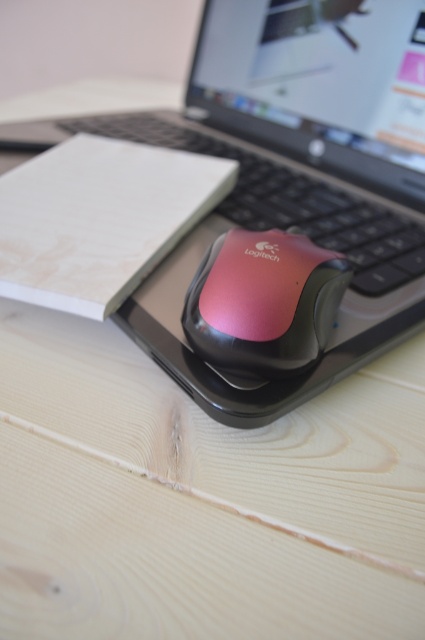
Consider the image. You are organizing your desk and need to place a small decorative item between the black plastic computer at center and the pink glossy mouse at center. Given their sizes, which object should you position closer to the edge of the desk to ensure the decorative item fits comfortably?

The pink glossy mouse at center is smaller in size than the black plastic computer at center, so positioning it closer to the edge would leave more space for the decorative item between them.

You are setting up a desk organizer and need to know the relative sizes of the items. Based on the scene, is the black plastic computer at center taller than the pink glossy mouse at center?

Yes, the black plastic computer at center is taller than the pink glossy mouse at center according to the description.